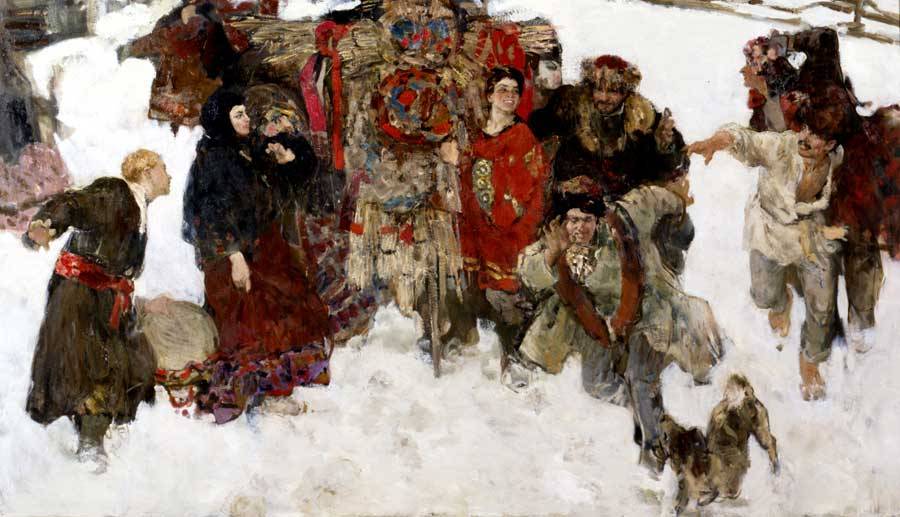
Where is `garland`? The image size is (900, 517). garland is located at coordinates click(770, 63).